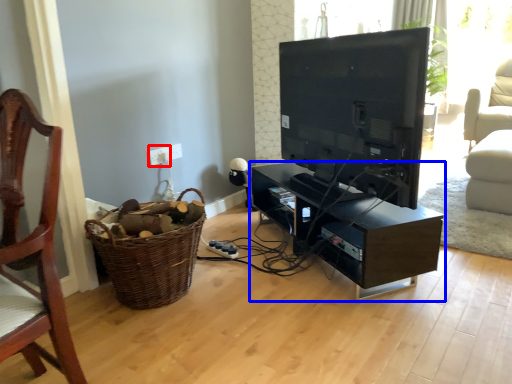
Question: Which point is closer to the camera, electric outlet (highlighted by a red box) or shelf (highlighted by a blue box)?

Choices:
 (A) electric outlet
 (B) shelf

Answer: (B)